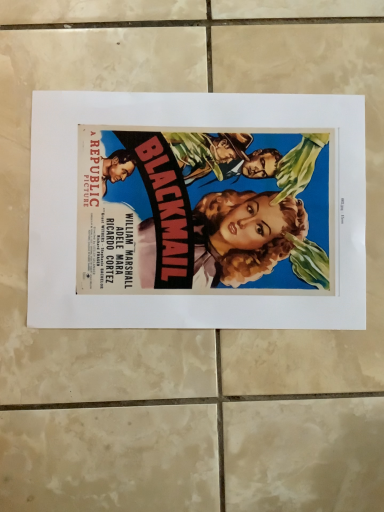
In order to click on free space above vivid paper poster at center (from a real-world perspective) in this screenshot , I will do `click(204, 206)`.